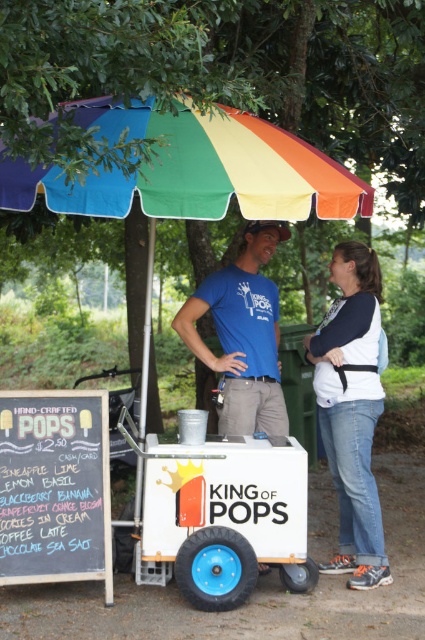
You are standing at the point labeled as point (351, 410) in the image. What object is directly beneath your feet?

The point (351, 410) is on blue jeans at lower right, so the object directly beneath your feet is the blue jeans at lower right.

You are a delivery person who needs to place a large box between the white plastic cart at center and the rainbow fabric umbrella at upper center. The box measures 1.5 meters in length. Will there be enough space between them to fit the box?

The distance between the white plastic cart at center and the rainbow fabric umbrella at upper center is 1.83 meters. Since the box is 1.5 meters long, there will be enough space to fit it between them with 0.33 meters remaining.

Please describe the location of the point marked at coordinates (218, 513) in the image. Which object is it pointing to?

The point at coordinates (218, 513) is pointing to the white plastic cart at center.